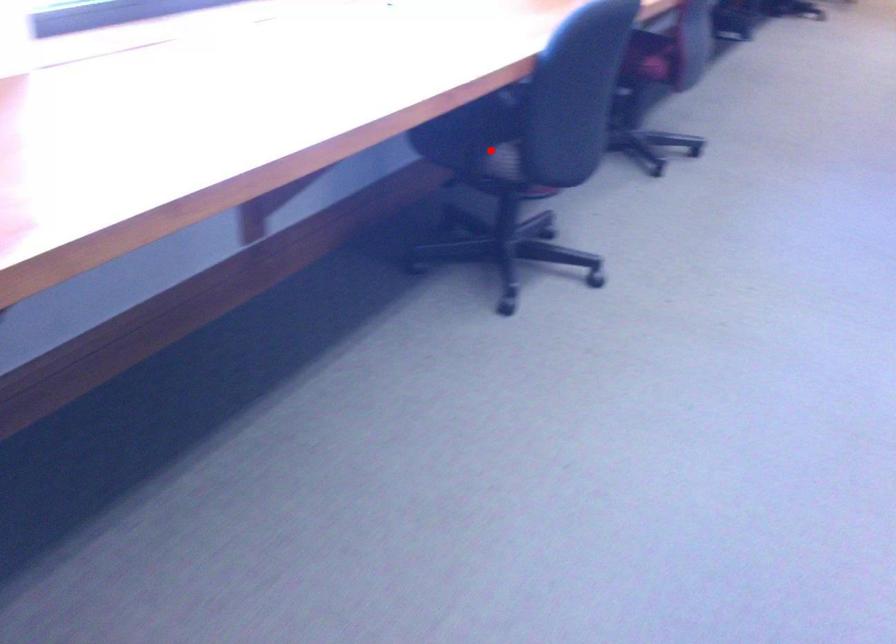
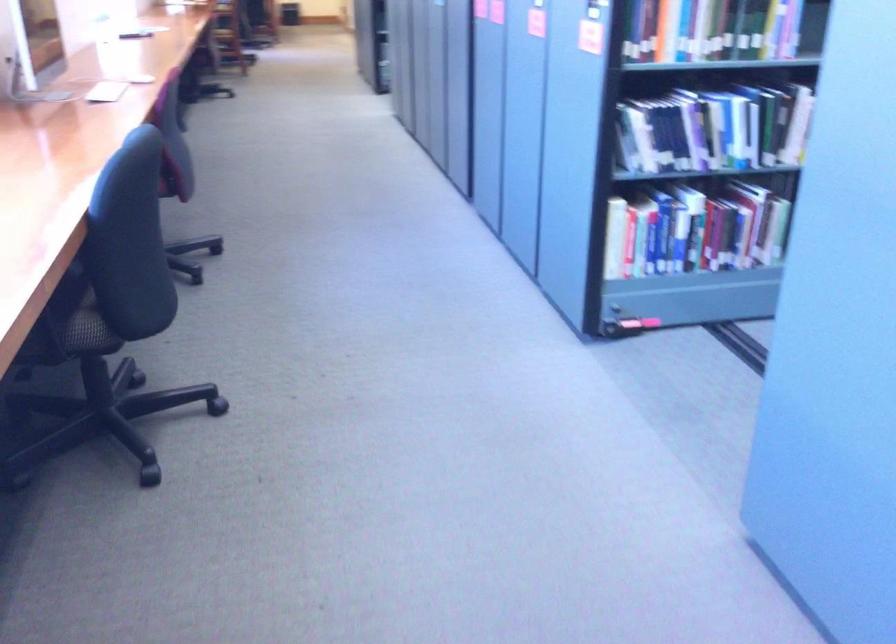
Question: I am providing you with two images of the same scene from different viewpoints. Given a red point in image1, look at the same physical point in image2. Is it:

Choices:
 (A) Closer to the viewpoint
 (B) Farther from the viewpoint

Answer: (A)